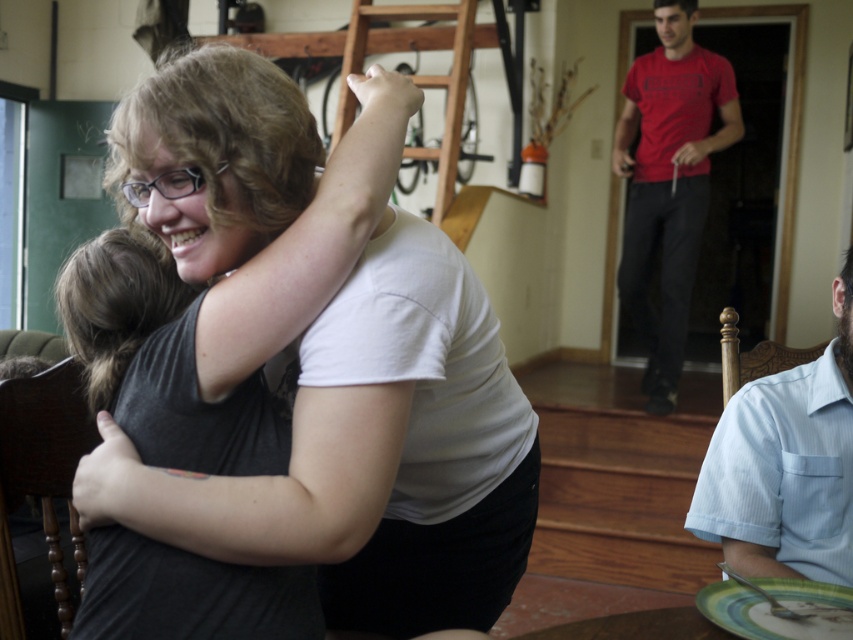
You are standing in the room and want to place a small object on the green glazed plate at lower right without touching the light blue striped shirt at lower right. Is this possible?

The light blue striped shirt at lower right is located above the green glazed plate at lower right, so placing the object on the plate without touching the shirt is possible as long as you carefully place it below the shirt.

Based on the coordinates provided, where is the light blue striped shirt at lower right located in the image?

The light blue striped shirt at lower right is located at the coordinates point (786, 465).